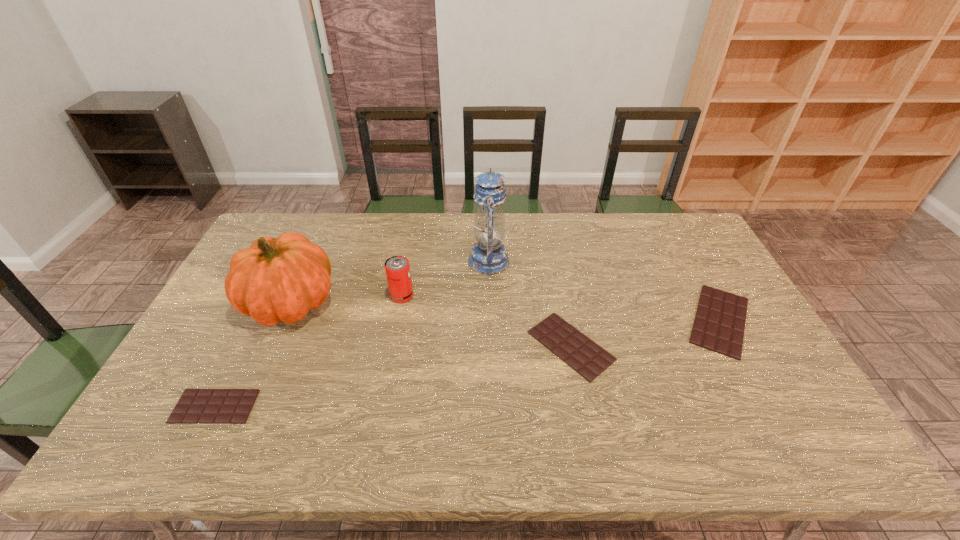
Please point a space for a new chocolate_bar to maintain equal intervals. Please provide its 2D coordinates. Your answer should be formatted as a tuple, i.e. [(x, y)], where the tuple contains the x and y coordinates of a point satisfying the conditions above.

[(403, 374)]